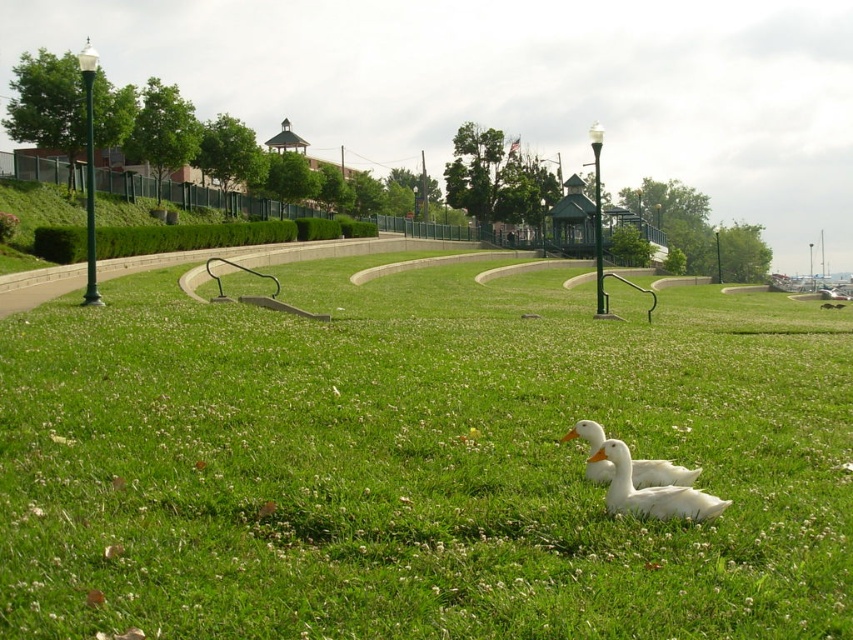
Can you confirm if green grassy at center is taller than white matte duck at lower right?

Indeed, green grassy at center has a greater height compared to white matte duck at lower right.

Can you confirm if green grassy at center is wider than white matte duck at lower right?

Indeed, green grassy at center has a greater width compared to white matte duck at lower right.

Describe the element at coordinates (416, 464) in the screenshot. I see `green grassy at center` at that location.

You are a GUI agent. You are given a task and a screenshot of the screen. Output one action in this format:
    pyautogui.click(x=<x>, y=<y>)
    Task: Click on the green grassy at center
    The image size is (853, 640).
    Given the screenshot: What is the action you would take?
    pyautogui.click(x=416, y=464)

Is white matte duck at lower right wider than white matte duck at center?

No, white matte duck at lower right is not wider than white matte duck at center.

Who is positioned more to the left, white matte duck at lower right or white matte duck at center?

white matte duck at center is more to the left.

Which is in front, point (618, 449) or point (670, 470)?

Point (618, 449)

The width and height of the screenshot is (853, 640). I want to click on white matte duck at lower right, so coord(651,492).

Which is below, white matte duck at center or white matte couple at center?

Positioned lower is white matte duck at center.

Is white matte duck at center thinner than white matte couple at center?

Yes.

Does point (651, 484) come farther from viewer compared to point (509, 243)?

No.

Locate an element on the screen. The height and width of the screenshot is (640, 853). white matte duck at center is located at coordinates (660, 474).